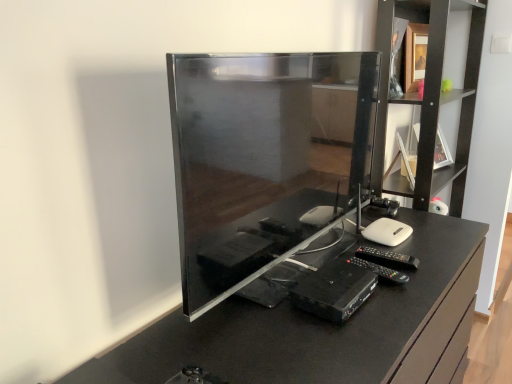
Identify the location of free space to the left of black plastic dvd player at center. (272, 307).